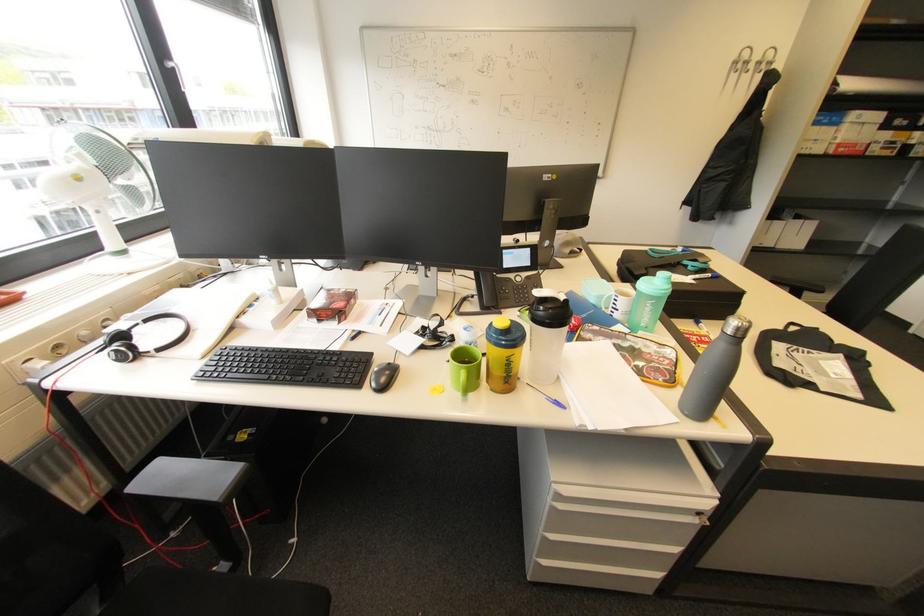
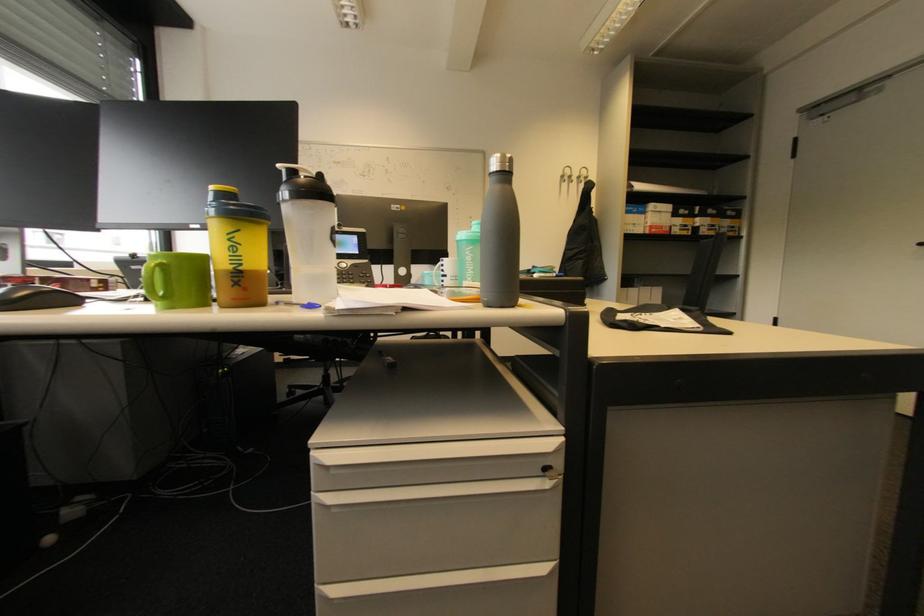
Locate, in the second image, the point that corresponds to [652,305] in the first image.

(472, 254)